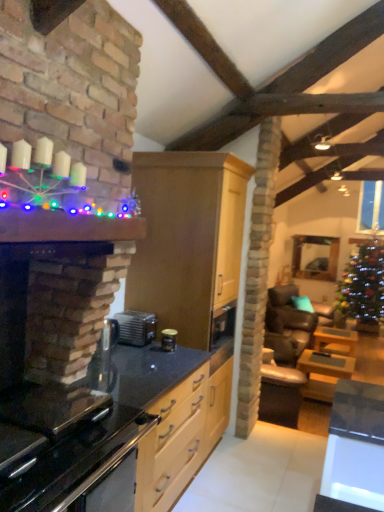
I want to click on yellow wood table at lower right, positioned as the third table in front-to-back order, so click(x=335, y=338).

This screenshot has height=512, width=384. In order to click on black glass oven at lower left in this screenshot , I will do `click(76, 462)`.

Describe the element at coordinates (90, 429) in the screenshot. I see `black granite countertop at center` at that location.

What do you see at coordinates (371, 206) in the screenshot? I see `clear glass door at upper right` at bounding box center [371, 206].

In order to click on satin silver toaster at center, arranged as the second appliance when viewed from the right in this screenshot , I will do pos(136,327).

Describe the element at coordinates (355, 448) in the screenshot. This screenshot has width=384, height=512. I see `wooden table at right, which appears as the first table when viewed from the front` at that location.

At what (x,y) coordinates should I click in order to perform the action: click on yellow wood table at lower right, positioned as the third table in front-to-back order. Please return your answer as a coordinate pair (x, y). Image resolution: width=384 pixels, height=512 pixels. Looking at the image, I should click on (335, 338).

Considering the sizes of objects wooden table at lower right, which is the second table in right-to-left order, and clear glass door at upper right in the image provided, who is bigger, wooden table at lower right, which is the second table in right-to-left order, or clear glass door at upper right?

→ Bigger between the two is wooden table at lower right, which is the second table in right-to-left order.

Find the location of `glass door on the right of the wooden table at lower right, the 2th table when ordered from left to right`. glass door on the right of the wooden table at lower right, the 2th table when ordered from left to right is located at coordinates (371, 206).

From the image's perspective, relative to clear glass door at upper right, is wooden table at lower right, which is the second table in right-to-left order, above or below?

Clearly, from the image's perspective, wooden table at lower right, which is the second table in right-to-left order, is below clear glass door at upper right.

Can we say wooden table at lower right, which is the second table in right-to-left order, lies outside clear glass door at upper right?

Yes, wooden table at lower right, which is the second table in right-to-left order, is not within clear glass door at upper right.

Is black glass oven at lower left beside light wood cabinet at center?

No, black glass oven at lower left is not making contact with light wood cabinet at center.

Considering the relative positions of black glass oven at lower left and light wood cabinet at center in the image provided, is black glass oven at lower left behind light wood cabinet at center?

No, black glass oven at lower left is closer to the camera.

Image resolution: width=384 pixels, height=512 pixels. What are the coordinates of `oven that is on the left side of light wood cabinet at center` in the screenshot? It's located at (x=76, y=462).

Who is bigger, black glass oven at lower left or light wood cabinet at center?

light wood cabinet at center.

Is wooden table at lower right, which is the second table in right-to-left order, completely or partially inside metallic canister at center, acting as the second appliance starting from the left?

No.

What's the angular difference between metallic canister at center, the 1th appliance positioned from the right, and wooden table at lower right, placed as the second table when sorted from front to back,'s facing directions?

2.09 degrees separate the facing orientations of metallic canister at center, the 1th appliance positioned from the right, and wooden table at lower right, placed as the second table when sorted from front to back.

Does metallic canister at center, acting as the second appliance starting from the left, have a greater height compared to wooden table at lower right, the 2th table from the back?

In fact, metallic canister at center, acting as the second appliance starting from the left, may be shorter than wooden table at lower right, the 2th table from the back.

Considering their positions, is metallic canister at center, acting as the second appliance starting from the left, located in front of or behind wooden table at lower right, placed as the second table when sorted from front to back?

metallic canister at center, acting as the second appliance starting from the left, is positioned closer to the viewer than wooden table at lower right, placed as the second table when sorted from front to back.

Which is less distant, (153, 320) or (270, 347)?

Point (153, 320).

Is satin silver toaster at center, arranged as the second appliance when viewed from the right, positioned far away from dark brown leather armchair at center-right?

Yes.

From a real-world perspective, relative to dark brown leather armchair at center-right, is satin silver toaster at center, which appears as the first appliance when viewed from the left, vertically above or below?

In terms of real-world spatial position, satin silver toaster at center, which appears as the first appliance when viewed from the left, is above dark brown leather armchair at center-right.

Based on the photo, is black granite countertop at center not within satin silver toaster at center, arranged as the second appliance when viewed from the right?

Yes, black granite countertop at center is located beyond the bounds of satin silver toaster at center, arranged as the second appliance when viewed from the right.

In terms of width, does black granite countertop at center look wider or thinner when compared to satin silver toaster at center, which appears as the first appliance when viewed from the left?

Considering their sizes, black granite countertop at center looks broader than satin silver toaster at center, which appears as the first appliance when viewed from the left.

From the picture: Is black granite countertop at center aimed at satin silver toaster at center, arranged as the second appliance when viewed from the right?

No, black granite countertop at center is not oriented towards satin silver toaster at center, arranged as the second appliance when viewed from the right.

Is black granite countertop at center directly adjacent to satin silver toaster at center, which appears as the first appliance when viewed from the left?

No.

Which object is further away from the camera taking this photo, green glittering christmas tree at right or dark brown leather armchair at center-right?

green glittering christmas tree at right is behind.

Are green glittering christmas tree at right and dark brown leather armchair at center-right located far from each other?

They are positioned close to each other.

Considering the points (361, 241) and (289, 317), which point is in front, point (361, 241) or point (289, 317)?

Positioned in front is point (289, 317).

Is green glittering christmas tree at right looking in the opposite direction of yellow wood table at lower right, placed as the first table when sorted from right to left?

No, green glittering christmas tree at right is not facing the opposite direction of yellow wood table at lower right, placed as the first table when sorted from right to left.

From the image's perspective, is green glittering christmas tree at right positioned above or below yellow wood table at lower right, placed as the first table when sorted from right to left?

green glittering christmas tree at right is above yellow wood table at lower right, placed as the first table when sorted from right to left.

Between green glittering christmas tree at right and yellow wood table at lower right, the 1th table positioned from the back, which one has smaller size?

yellow wood table at lower right, the 1th table positioned from the back.

Can you see green glittering christmas tree at right touching yellow wood table at lower right, placed as the first table when sorted from right to left?

green glittering christmas tree at right and yellow wood table at lower right, placed as the first table when sorted from right to left, are not in contact.

Locate an element on the screen. The height and width of the screenshot is (512, 384). the 2nd table to the left of the clear glass door at upper right, counting from the anchor's position is located at coordinates (323, 374).

The width and height of the screenshot is (384, 512). I want to click on cabinetry above the black glass oven at lower left (from the image's perspective), so click(x=189, y=242).

Estimate the real-world distances between objects in this image. Which object is further from yellow wood table at lower right, positioned as the third table in front-to-back order, green glittering christmas tree at right or dark brown leather armchair at center-right?

The object further to yellow wood table at lower right, positioned as the third table in front-to-back order, is green glittering christmas tree at right.

From the image, which object appears to be farther from yellow wood table at lower right, positioned as the third table in front-to-back order, wooden table at right, which appears as the third table when viewed from the right, or dark brown leather armchair at center-right?

wooden table at right, which appears as the third table when viewed from the right, is further to yellow wood table at lower right, positioned as the third table in front-to-back order.

Looking at the image, which one is located closer to dark brown leather armchair at center-right, wooden table at lower right, which is the second table in right-to-left order, or light wood cabinet at center?

wooden table at lower right, which is the second table in right-to-left order.

Considering their positions, is wooden table at lower right, the 2th table when ordered from left to right, positioned further to light wood cabinet at center than black glass oven at lower left?

Among the two, wooden table at lower right, the 2th table when ordered from left to right, is located further to light wood cabinet at center.

From the picture: Based on their spatial positions, is wooden table at right, which appears as the third table when viewed from the right, or yellow wood table at lower right, the 1th table positioned from the back, closer to wooden table at lower right, placed as the second table when sorted from front to back?

yellow wood table at lower right, the 1th table positioned from the back, is closer to wooden table at lower right, placed as the second table when sorted from front to back.

Estimate the real-world distances between objects in this image. Which object is further from yellow wood table at lower right, positioned as the third table in front-to-back order, light wood cabinet at center or satin silver toaster at center, arranged as the second appliance when viewed from the right?

Among the two, satin silver toaster at center, arranged as the second appliance when viewed from the right, is located further to yellow wood table at lower right, positioned as the third table in front-to-back order.

From the image, which object appears to be farther from dark brown leather armchair at center-right, satin silver toaster at center, arranged as the second appliance when viewed from the right, or wooden table at right, which appears as the first table when viewed from the front?

wooden table at right, which appears as the first table when viewed from the front, lies further to dark brown leather armchair at center-right than the other object.

Which object lies nearer to the anchor point light wood cabinet at center, black glass oven at lower left or metallic canister at center, acting as the second appliance starting from the left?

Among the two, metallic canister at center, acting as the second appliance starting from the left, is located nearer to light wood cabinet at center.

Locate an element on the screen. Image resolution: width=384 pixels, height=512 pixels. armchair between metallic canister at center, acting as the second appliance starting from the left, and green glittering christmas tree at right from front to back is located at coordinates (287, 326).

Find the location of `armchair positioned between black glass oven at lower left and green glittering christmas tree at right from near to far`. armchair positioned between black glass oven at lower left and green glittering christmas tree at right from near to far is located at coordinates (287, 326).

This screenshot has width=384, height=512. What are the coordinates of `table between wooden table at right, marked as the 3th table in a back-to-front arrangement, and yellow wood table at lower right, positioned as the third table in front-to-back order, along the z-axis` in the screenshot? It's located at (323, 374).

I want to click on cabinetry between black glass oven at lower left and dark brown leather armchair at center-right from front to back, so click(x=189, y=242).